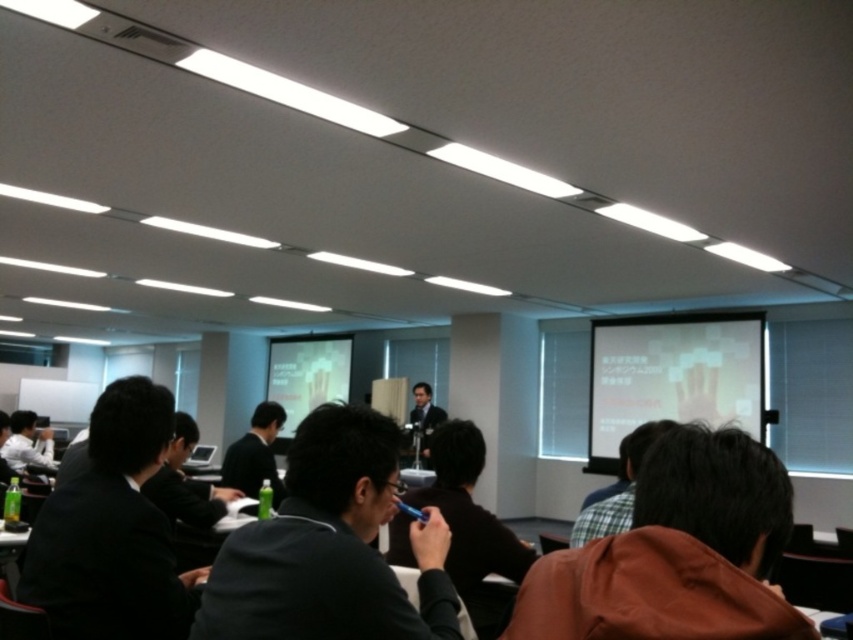
You are an attendee sitting in the conference room and want to focus on the presentation. Which object, the matte white projector screen at center or the white shirt at left, is closer to you as you face the front of the room?

The matte white projector screen at center is closer to you because it is further to the viewer than the white shirt at left, meaning it appears nearer in your line of sight.

You are standing in the conference room and need to locate the matte white projector screen at center. According to the coordinates provided, where should you look to find it?

The matte white projector screen at center is located at coordinates point (306,374).